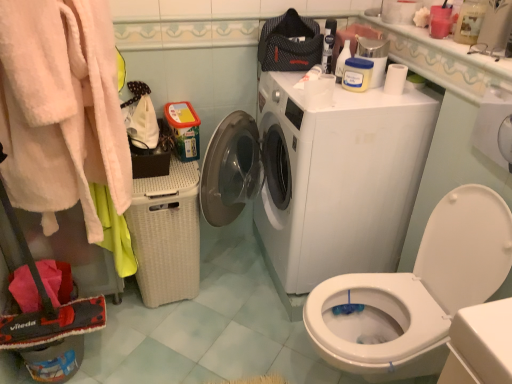
Find the location of `vacant space to the left of matte white jar at upper center`. vacant space to the left of matte white jar at upper center is located at coordinates (298, 81).